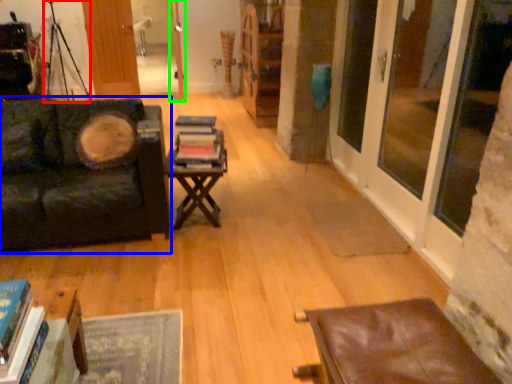
Question: Which object is the closest to the tripod (highlighted by a red box)? Choose among these: studio couch (highlighted by a blue box) or door (highlighted by a green box).

Choices:
 (A) studio couch
 (B) door

Answer: (B)